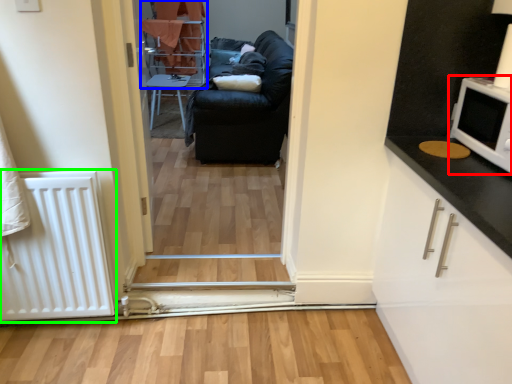
Question: Estimate the real-world distances between objects in this image. Which object is farther from appliance (highlighted by a red box), bunk bed (highlighted by a blue box) or radiator (highlighted by a green box)?

Choices:
 (A) bunk bed
 (B) radiator

Answer: (A)